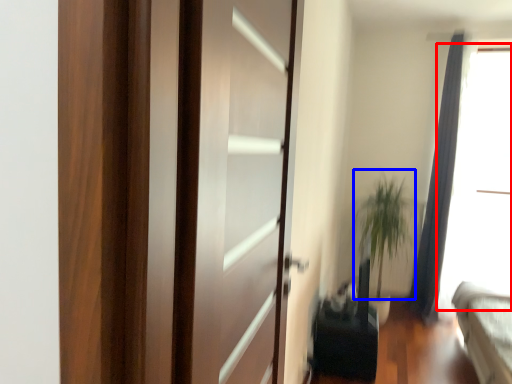
Question: Which point is closer to the camera, window screen (highlighted by a red box) or plant (highlighted by a blue box)?

Choices:
 (A) window screen
 (B) plant

Answer: (A)